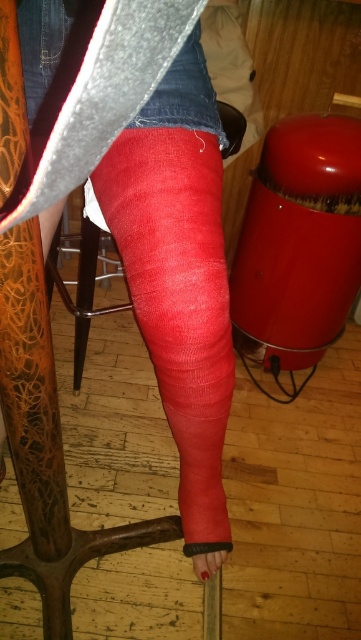
Question: Does matte red cast at center have a smaller size compared to red fabric sock at center?

Choices:
 (A) yes
 (B) no

Answer: (B)

Question: Considering the real-world distances, which object is closest to the red fabric sock at center?

Choices:
 (A) matte red cast at center
 (B) matte red bandage at lower center

Answer: (A)

Question: Is red fabric sock at center positioned at the back of matte red bandage at lower center?

Choices:
 (A) no
 (B) yes

Answer: (A)

Question: Among these points, which one is farthest from the camera?

Choices:
 (A) (135, 257)
 (B) (24, 58)
 (C) (210, 564)

Answer: (C)

Question: Which object is closer to the camera taking this photo?

Choices:
 (A) red fabric sock at center
 (B) matte red bandage at lower center
 (C) matte red cast at center

Answer: (C)

Question: Can you confirm if matte red cast at center is positioned above matte red bandage at lower center?

Choices:
 (A) yes
 (B) no

Answer: (A)